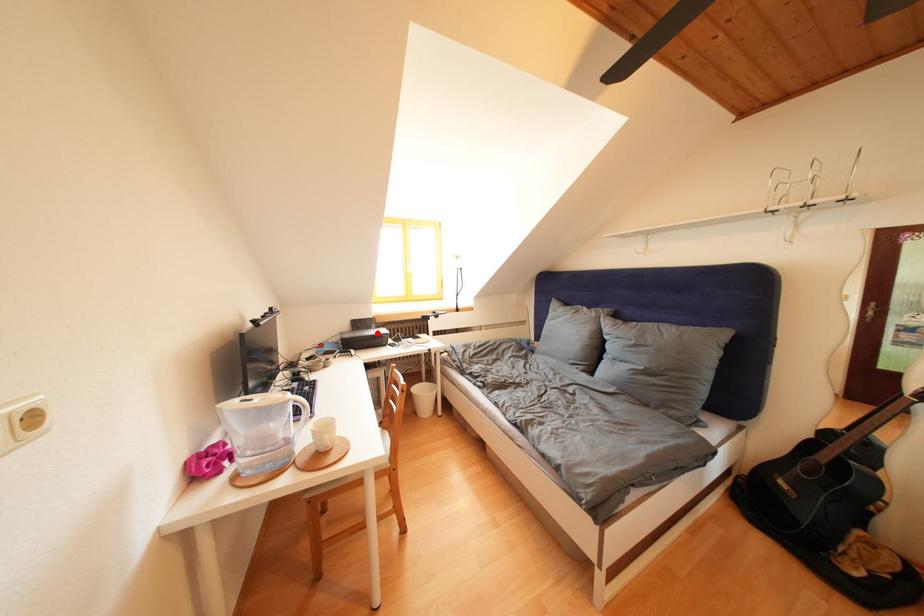
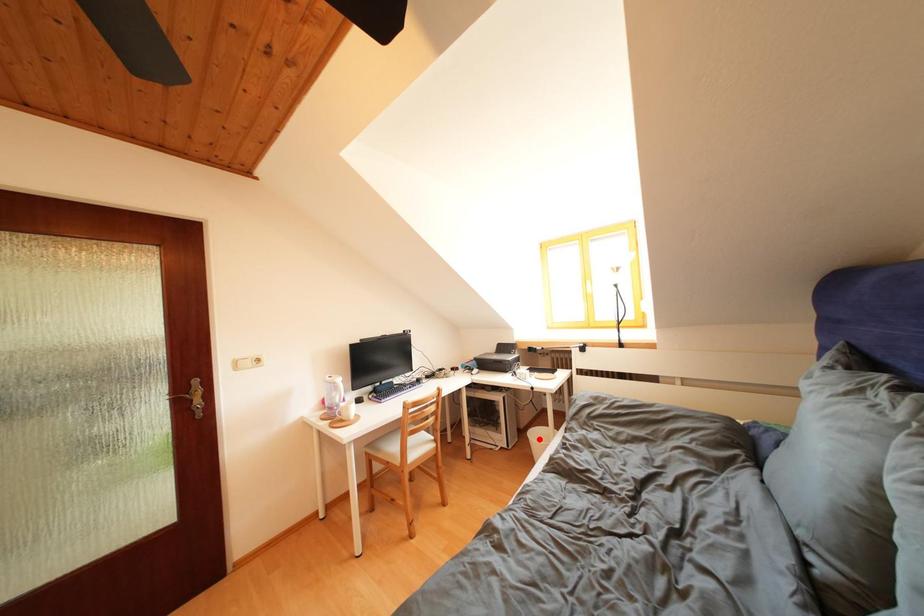
I am providing you with two images of the same scene from different viewpoints. A red point is marked on the first image and another point is marked on the second image. Do the highlighted points in image1 and image2 indicate the same real-world spot?

No